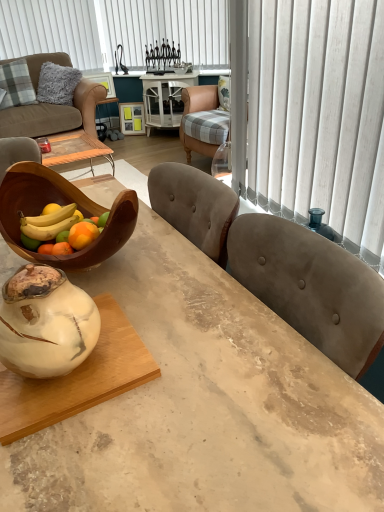
Question: From the image's perspective, would you say wooden bowl at left is positioned over white vertical blinds at upper center?

Choices:
 (A) no
 (B) yes

Answer: (A)

Question: Is wooden bowl at left facing away from white vertical blinds at upper center?

Choices:
 (A) no
 (B) yes

Answer: (A)

Question: Can you see wooden bowl at left touching white vertical blinds at upper center?

Choices:
 (A) no
 (B) yes

Answer: (A)

Question: Considering the relative sizes of wooden bowl at left and white vertical blinds at upper center in the image provided, is wooden bowl at left bigger than white vertical blinds at upper center?

Choices:
 (A) yes
 (B) no

Answer: (B)

Question: From the image's perspective, is wooden bowl at left located beneath white vertical blinds at upper center?

Choices:
 (A) yes
 (B) no

Answer: (A)

Question: Would you say white marble vase at center is to the left or to the right of white marble round table at center in the picture?

Choices:
 (A) right
 (B) left

Answer: (B)

Question: Is white marble vase at center situated inside white marble round table at center or outside?

Choices:
 (A) outside
 (B) inside

Answer: (A)

Question: Is point (59, 362) closer or farther from the camera than point (167, 74)?

Choices:
 (A) farther
 (B) closer

Answer: (B)

Question: Based on their sizes in the image, would you say white marble vase at center is bigger or smaller than white marble round table at center?

Choices:
 (A) big
 (B) small

Answer: (B)

Question: Is white marble coffee table at lower left in front of or behind white marble round table at center in the image?

Choices:
 (A) behind
 (B) front

Answer: (B)

Question: Looking at the image, does white marble coffee table at lower left seem bigger or smaller compared to white marble round table at center?

Choices:
 (A) big
 (B) small

Answer: (B)

Question: In terms of height, does white marble coffee table at lower left look taller or shorter compared to white marble round table at center?

Choices:
 (A) short
 (B) tall

Answer: (A)

Question: In the image, is white marble coffee table at lower left on the left side or the right side of white marble round table at center?

Choices:
 (A) right
 (B) left

Answer: (B)

Question: Relative to plaid fabric pillow at upper left, is white vertical blinds at upper center in front or behind?

Choices:
 (A) front
 (B) behind

Answer: (B)

Question: From the image's perspective, is white vertical blinds at upper center above or below plaid fabric pillow at upper left?

Choices:
 (A) below
 (B) above

Answer: (B)